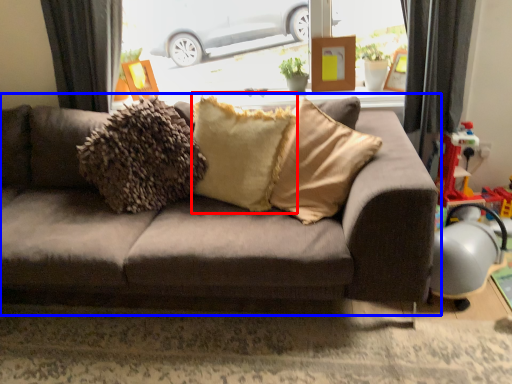
Question: Among these objects, which one is nearest to the camera, pillow (highlighted by a red box) or studio couch (highlighted by a blue box)?

Choices:
 (A) pillow
 (B) studio couch

Answer: (B)